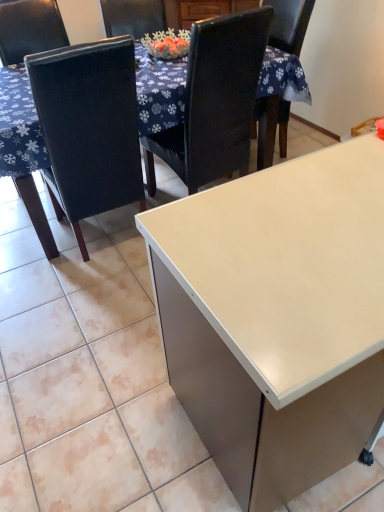
Question: From a real-world perspective, relative to matte black chair at left, the 2th chair from the right, is white glossy table at upper center vertically above or below?

Choices:
 (A) below
 (B) above

Answer: (A)

Question: Considering the positions of white glossy table at upper center and matte black chair at left, the 2th chair from the right, in the image, is white glossy table at upper center wider or thinner than matte black chair at left, the 2th chair from the right,?

Choices:
 (A) thin
 (B) wide

Answer: (B)

Question: Estimate the real-world distances between objects in this image. Which object is farther from the black leather chair at upper center, placed as the 1th chair when sorted from right to left?

Choices:
 (A) white glossy table at upper center
 (B) matte black chair at left, the 2th chair from the right
 (C) white glossy desk at center

Answer: (C)

Question: Based on their relative distances, which object is farther from the black leather chair at upper center, placed as the 1th chair when sorted from right to left?

Choices:
 (A) matte black chair at left, the first chair when ordered from left to right
 (B) white glossy table at upper center
 (C) white glossy desk at center

Answer: (C)